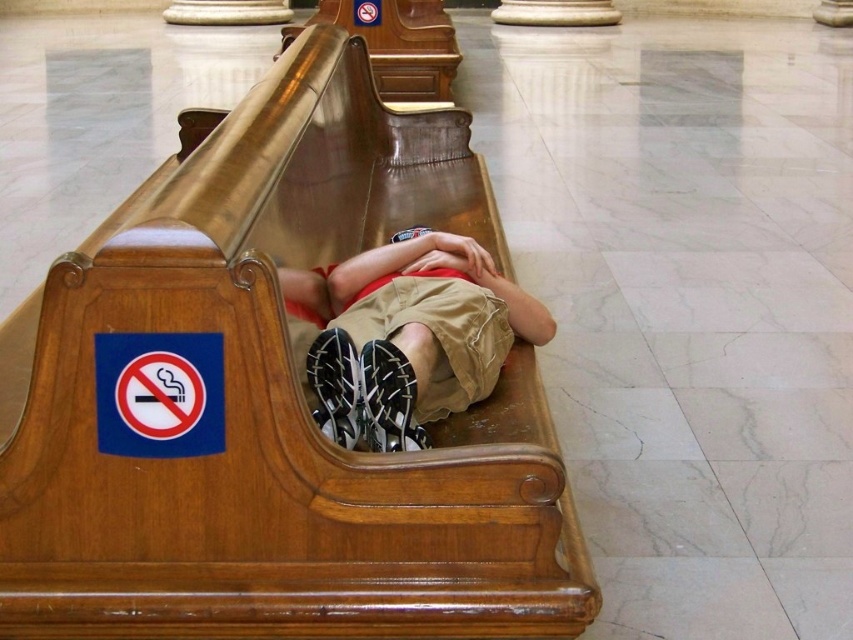
Who is higher up, polished wood church bench at center or khaki cotton shorts at center?

polished wood church bench at center is above.

In the scene shown: Can you confirm if polished wood church bench at center is thinner than khaki cotton shorts at center?

No, polished wood church bench at center is not thinner than khaki cotton shorts at center.

Find the location of a particular element. polished wood church bench at center is located at coordinates (279, 404).